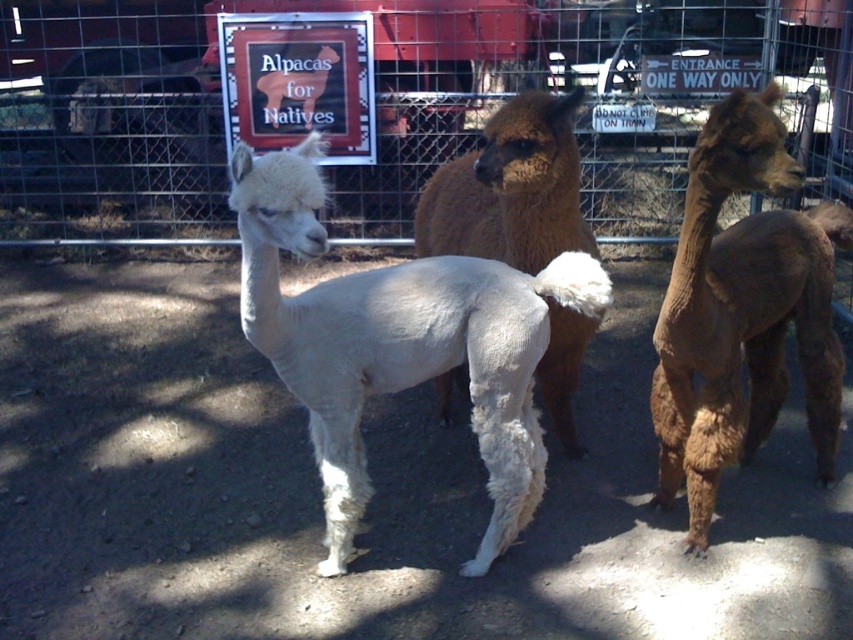
Question: Is metal wire fence at center below brown fuzzy alpaca at right?

Choices:
 (A) yes
 (B) no

Answer: (B)

Question: Can you confirm if metal wire fence at center is positioned below brown fuzzy alpaca at right?

Choices:
 (A) yes
 (B) no

Answer: (B)

Question: Which is farther from the white fluffy alpaca at center?

Choices:
 (A) brown fuzzy alpaca at right
 (B) brown fuzzy alpaca at center

Answer: (A)

Question: Which of the following is the closest to the observer?

Choices:
 (A) metal wire fence at center
 (B) brown fuzzy alpaca at center
 (C) white fluffy alpaca at center

Answer: (C)

Question: Which object is positioned closest to the white fluffy alpaca at center?

Choices:
 (A) metal wire fence at center
 (B) brown fuzzy alpaca at right

Answer: (B)

Question: Is white fluffy alpaca at center to the left of brown fuzzy alpaca at right from the viewer's perspective?

Choices:
 (A) yes
 (B) no

Answer: (A)